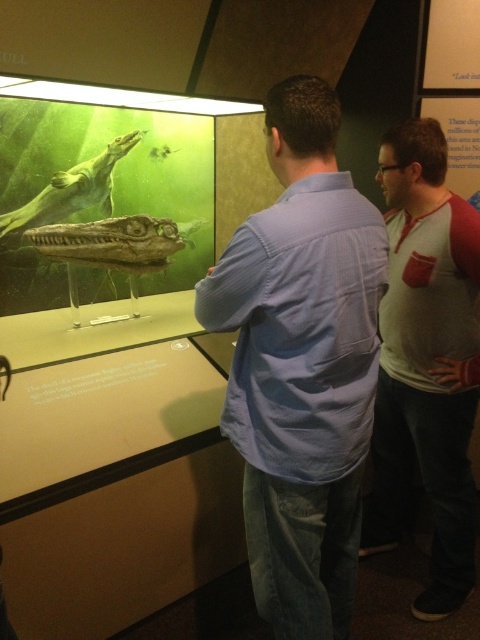
Question: Estimate the real-world distances between objects in this image. Which object is farther from the white/red cotton shirt at center-right?

Choices:
 (A) matte green fossil at upper left
 (B) light blue shirt at center

Answer: (A)

Question: Is light blue shirt at center below matte green fossil at upper left?

Choices:
 (A) no
 (B) yes

Answer: (B)

Question: Which of the following is the closest to the observer?

Choices:
 (A) matte green fossil at upper left
 (B) white/red cotton shirt at center-right

Answer: (B)

Question: Does light blue shirt at center have a smaller size compared to matte green fossil at upper left?

Choices:
 (A) no
 (B) yes

Answer: (A)

Question: Does light blue shirt at center have a greater width compared to matte green fossil at upper left?

Choices:
 (A) yes
 (B) no

Answer: (B)

Question: Among these objects, which one is farthest from the camera?

Choices:
 (A) matte green fossil at upper left
 (B) white/red cotton shirt at center-right
 (C) light blue shirt at center

Answer: (A)